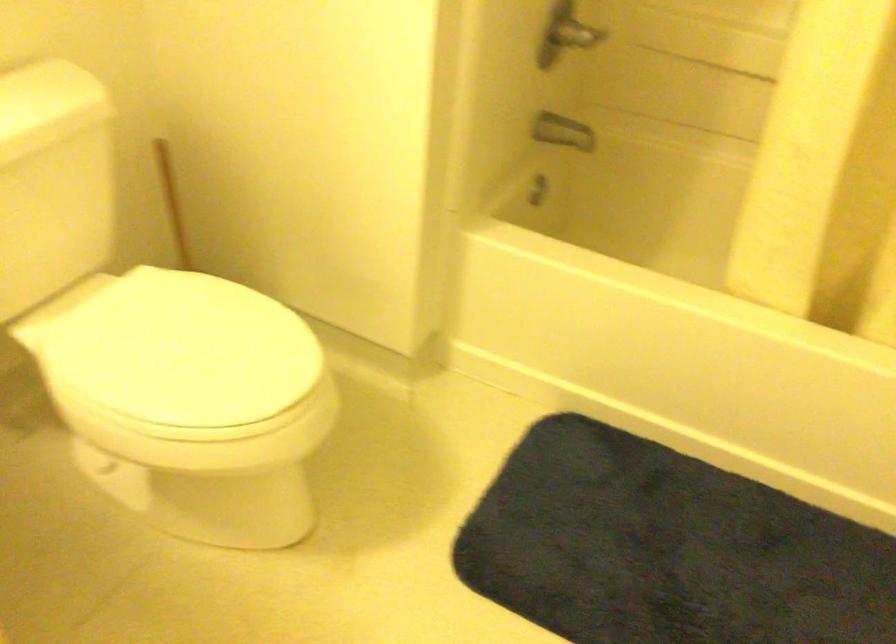
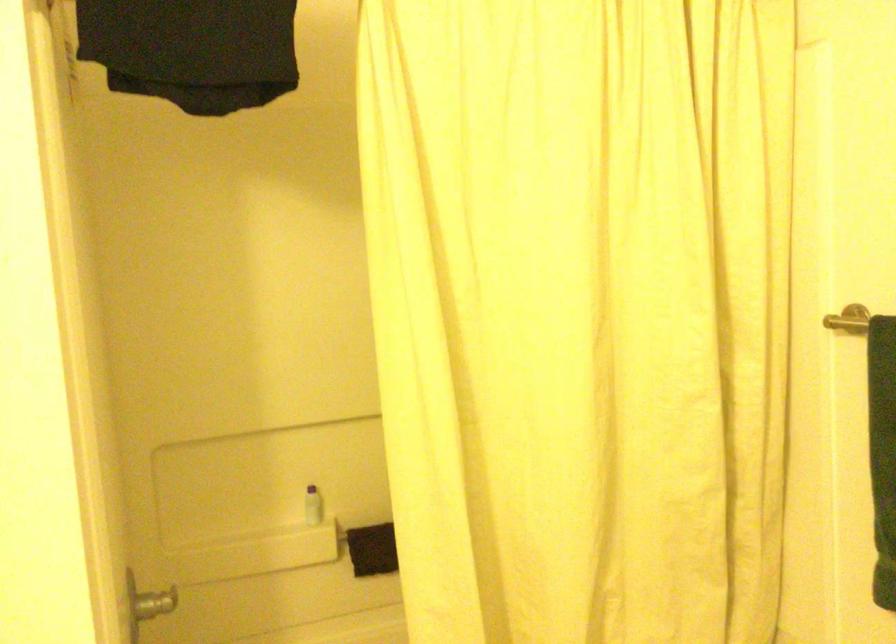
The images are taken continuously from a first-person perspective. In which direction is your viewpoint rotating?

The camera's rotation is toward right-up.